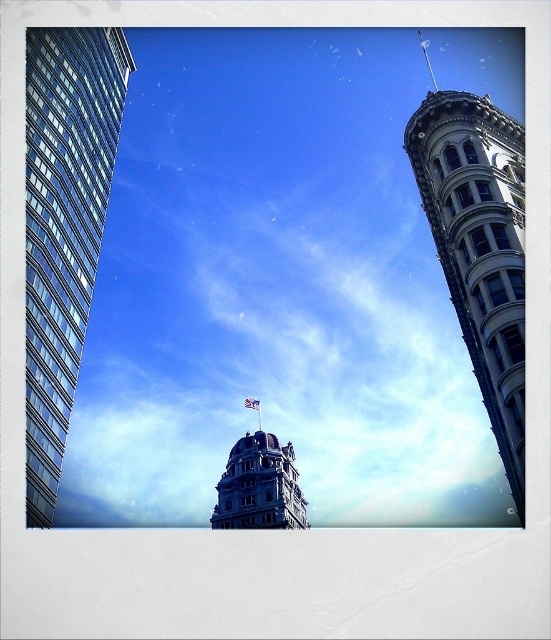
From the picture: Is white fluffy cloud at center shorter than white stone tower at upper right?

No.

Does point (153, 230) come behind point (482, 276)?

Yes, point (153, 230) is farther from viewer.

Which is behind, point (180, 509) or point (478, 378)?

Positioned behind is point (180, 509).

Where is `white fluffy cloud at center`? white fluffy cloud at center is located at coordinates (276, 344).

How much distance is there between white fluffy cloud at center and white fabric flag at center?

The distance of white fluffy cloud at center from white fabric flag at center is 25.21 meters.

Locate an element on the screen. This screenshot has width=551, height=640. white fluffy cloud at center is located at coordinates (276, 344).

In order to click on white fluffy cloud at center in this screenshot , I will do `click(276, 344)`.

Does white stone tower at upper right have a larger size compared to white fabric flag at center?

Yes.

Can you confirm if white stone tower at upper right is smaller than white fabric flag at center?

No.

Between point (518, 314) and point (249, 406), which one is positioned in front?

Point (518, 314) is more forward.

The image size is (551, 640). Identify the location of white stone tower at upper right. (479, 248).